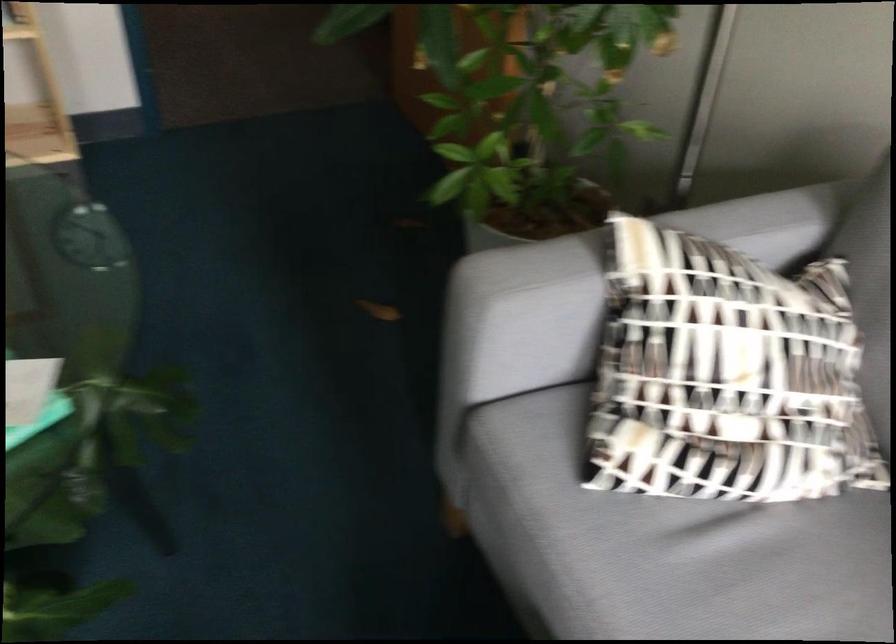
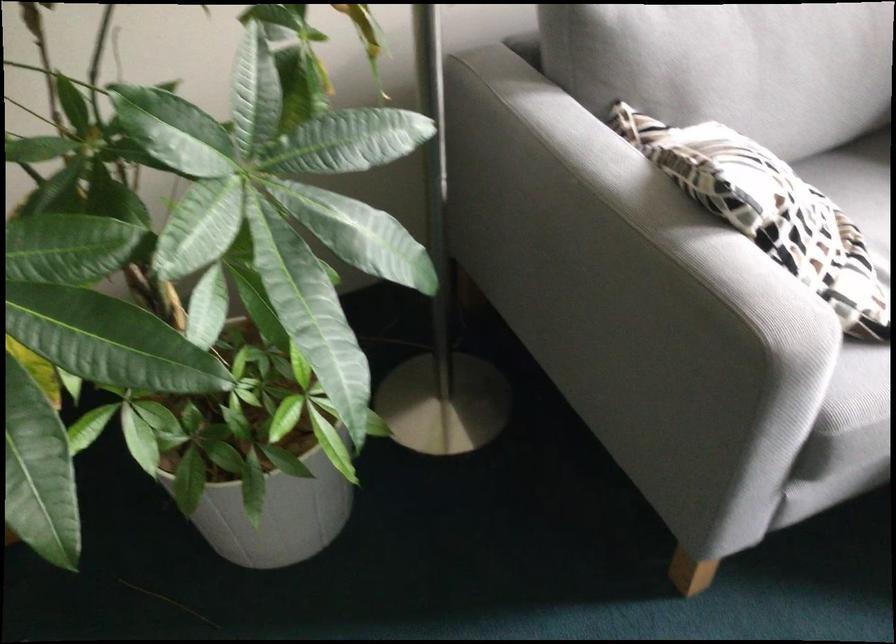
Locate, in the second image, the point that corresponds to point 656,278 in the first image.

(768, 212)